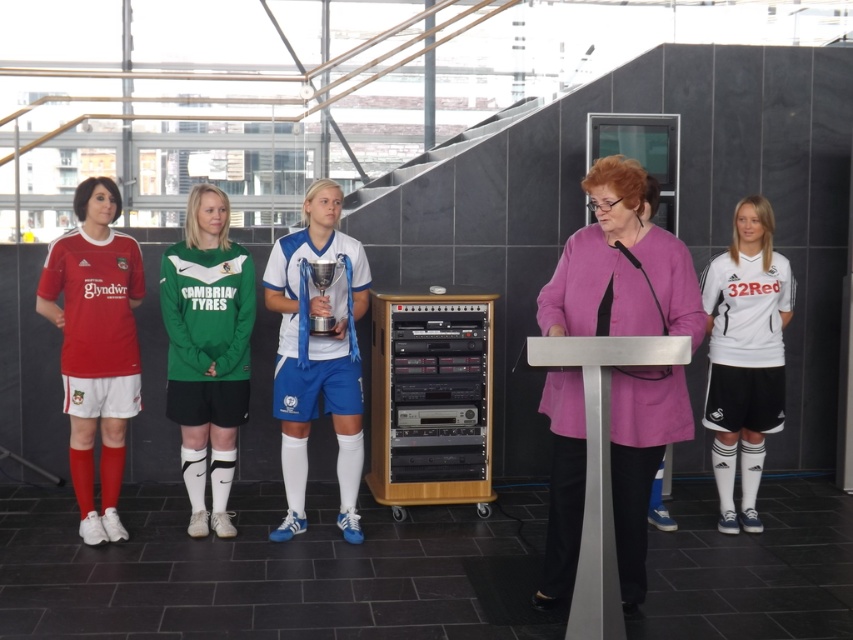
Is matte red jersey at left positioned at the back of green jersey at center?

That is False.

In the scene shown: Can you confirm if matte red jersey at left is wider than green jersey at center?

Indeed, matte red jersey at left has a greater width compared to green jersey at center.

Is point (131, 369) farther from viewer compared to point (213, 312)?

No, (131, 369) is closer to viewer.

Locate an element on the screen. matte red jersey at left is located at coordinates (96, 346).

Which is in front, point (612, 484) or point (329, 253)?

Positioned in front is point (612, 484).

Does pink fabric jacket at center appear over blue fabric jersey at center?

Incorrect, pink fabric jacket at center is not positioned above blue fabric jersey at center.

Locate an element on the screen. pink fabric jacket at center is located at coordinates (621, 268).

Locate an element on the screen. Image resolution: width=853 pixels, height=640 pixels. pink fabric jacket at center is located at coordinates (621, 268).

Is blue fabric jersey at center taller than white jersey at center?

Yes, blue fabric jersey at center is taller than white jersey at center.

Who is more distant from viewer, (355, 536) or (741, 262)?

Positioned behind is point (741, 262).

This screenshot has height=640, width=853. I want to click on blue fabric jersey at center, so click(x=317, y=355).